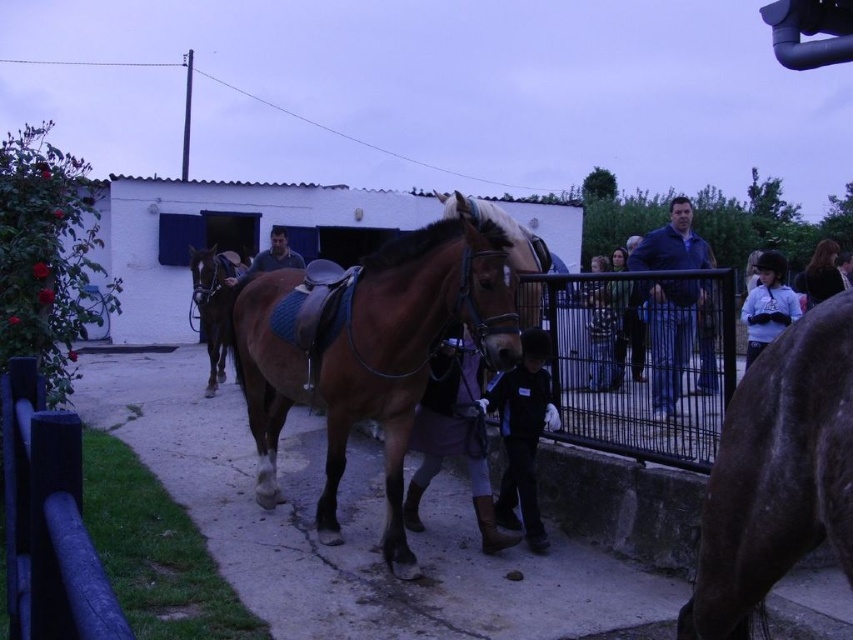
Does brown glossy horse at right appear over dark blue jeans at center?

Incorrect, brown glossy horse at right is not positioned above dark blue jeans at center.

Does brown glossy horse at right have a smaller size compared to dark blue jeans at center?

Incorrect, brown glossy horse at right is not smaller in size than dark blue jeans at center.

Between point (730, 589) and point (589, 348), which one is positioned in front?

Point (730, 589) is more forward.

Locate an element on the screen. The height and width of the screenshot is (640, 853). brown glossy horse at right is located at coordinates (776, 474).

Is point (415, 342) positioned after point (480, 520)?

No, it is in front of (480, 520).

Does brown glossy saddle at center come behind dark brown leather boots at center?

Answer: No.

Identify the location of brown glossy saddle at center. The image size is (853, 640). (368, 353).

Find the location of `brown glossy saddle at center`. brown glossy saddle at center is located at coordinates 368,353.

This screenshot has height=640, width=853. What do you see at coordinates (454, 435) in the screenshot?
I see `dark brown leather boots at center` at bounding box center [454, 435].

Who is more forward, (x=422, y=465) or (x=817, y=288)?

Point (x=422, y=465)

In order to click on dark brown leather boots at center in this screenshot , I will do `click(454, 435)`.